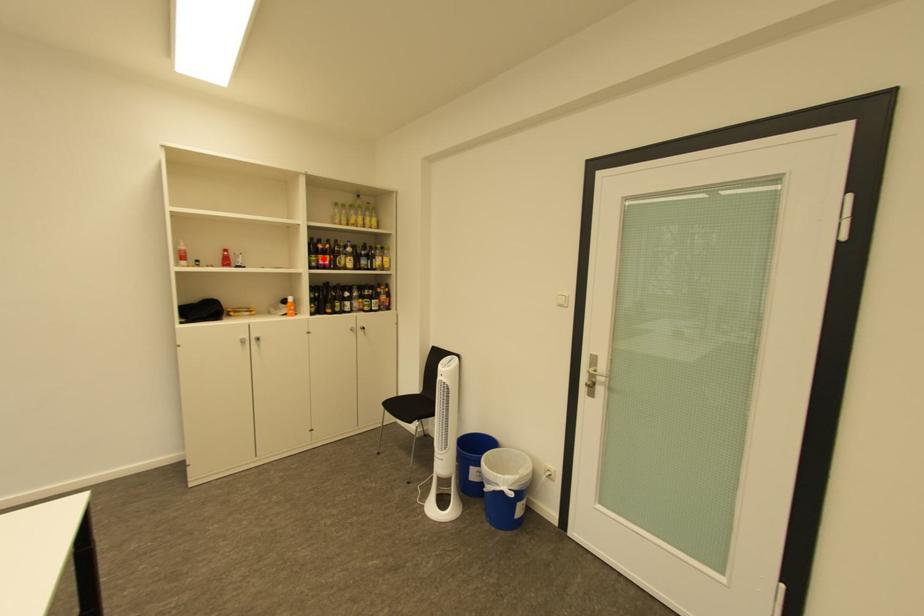
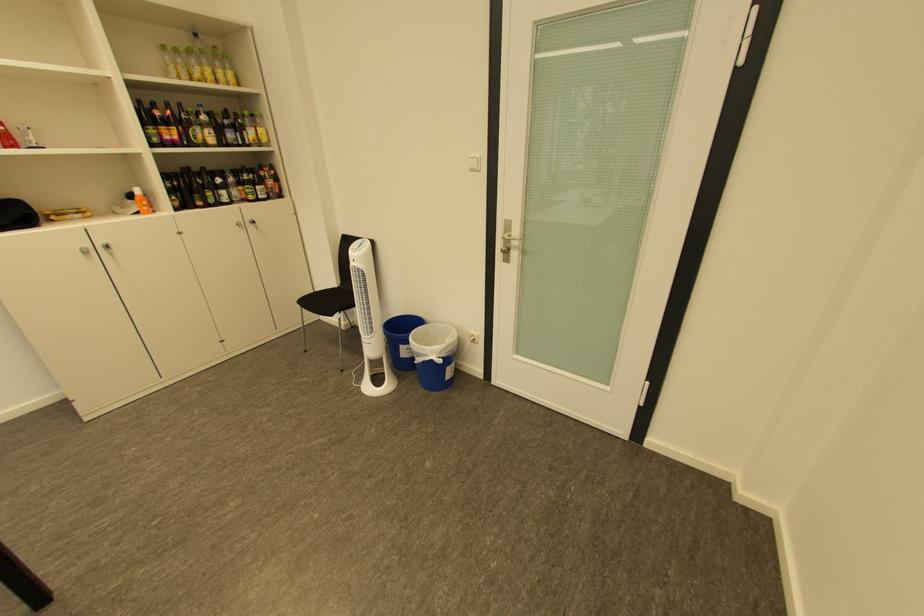
Question: I am providing you with two images of the same scene from different viewpoints. A red point is shown in image1. For the corresponding object point in image2, is it positioned nearer or farther from the camera?

Choices:
 (A) Nearer
 (B) Farther

Answer: (B)